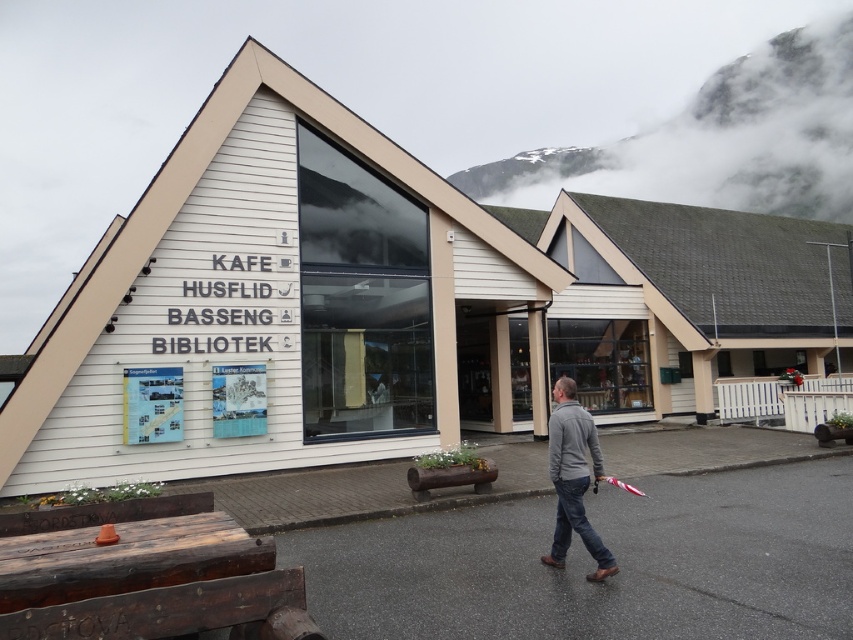
Question: Estimate the real-world distances between objects in this image. Which object is farther from the gray asphalt at lower center?

Choices:
 (A) gray fabric jacket at center
 (B) white wood building at center

Answer: (B)

Question: Which is nearer to the gray asphalt at lower center?

Choices:
 (A) white wood building at center
 (B) gray fabric jacket at center

Answer: (B)

Question: Can you confirm if white wood building at center is wider than gray asphalt at lower center?

Choices:
 (A) yes
 (B) no

Answer: (A)

Question: Does gray asphalt at lower center lie in front of gray fabric jacket at center?

Choices:
 (A) no
 (B) yes

Answer: (B)

Question: Where is white wood building at center located in relation to gray fabric jacket at center in the image?

Choices:
 (A) left
 (B) right

Answer: (B)

Question: Which point is closer to the camera taking this photo?

Choices:
 (A) (693, 410)
 (B) (346, 577)

Answer: (B)